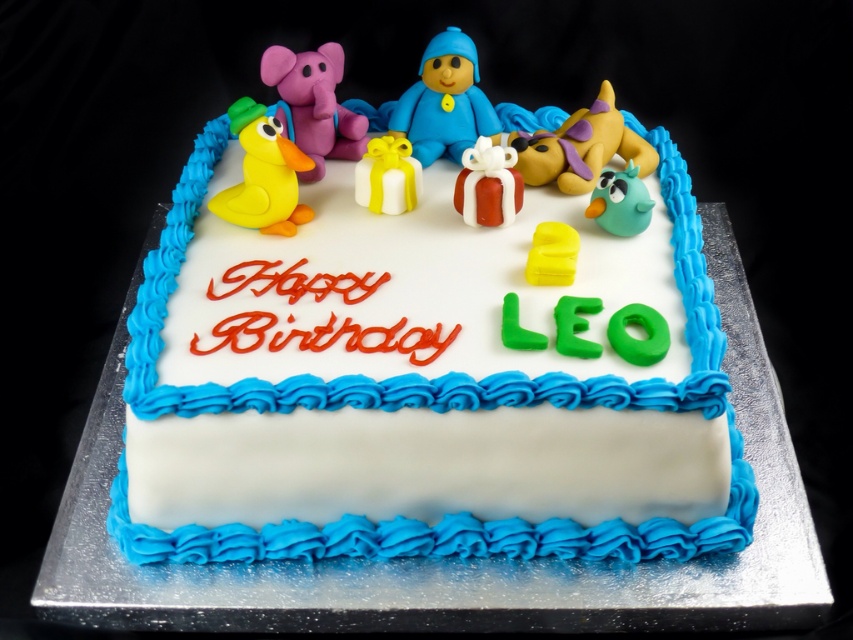
You are a guest at a birthday party and want to place a candle on the tallest decoration on the cake. Which decoration should you choose between the blue matte figure at center and the white fondant gift at center?

The blue matte figure at center is much taller than the white fondant gift at center, so you should place the candle on the blue matte figure at center.

You are a guest at a birthday party and want to take a photo of the blue matte figure at center and the white fondant gift at center on the cake. Which one is placed higher up?

The blue matte figure at center is positioned over the white fondant gift at center, so it is higher up.